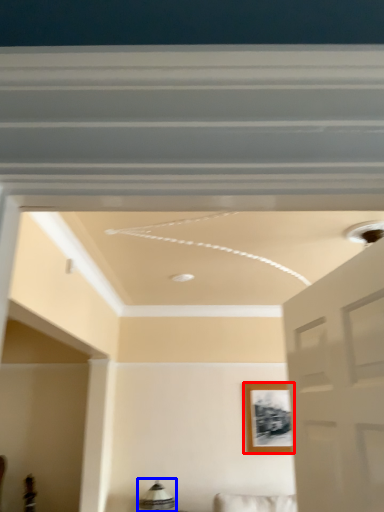
Question: Which of the following is the farthest to the observer, picture frame (highlighted by a red box) or lamp (highlighted by a blue box)?

Choices:
 (A) picture frame
 (B) lamp

Answer: (A)